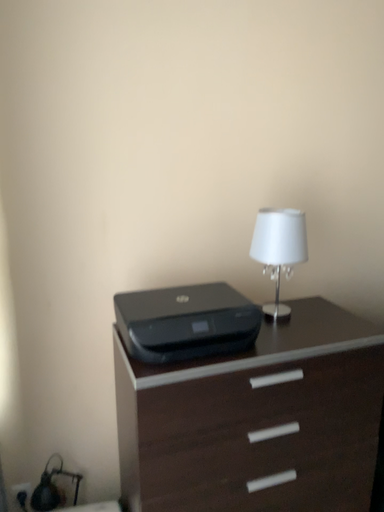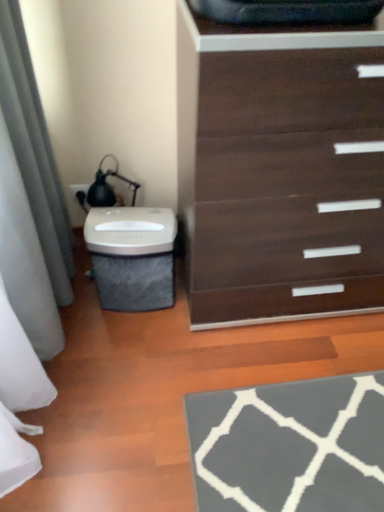
Question: Which way did the camera rotate in the video?

Choices:
 (A) rotated downward
 (B) rotated upward

Answer: (A)